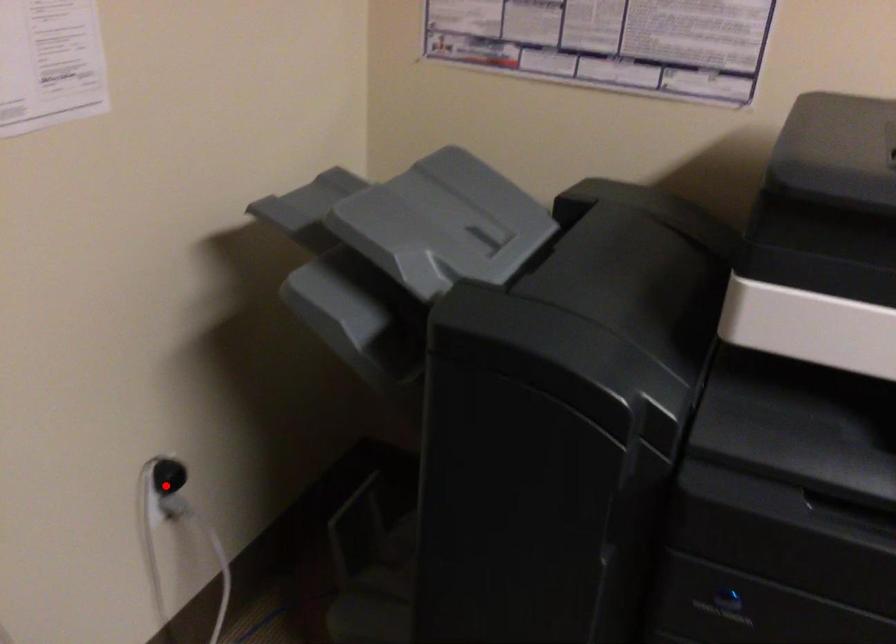
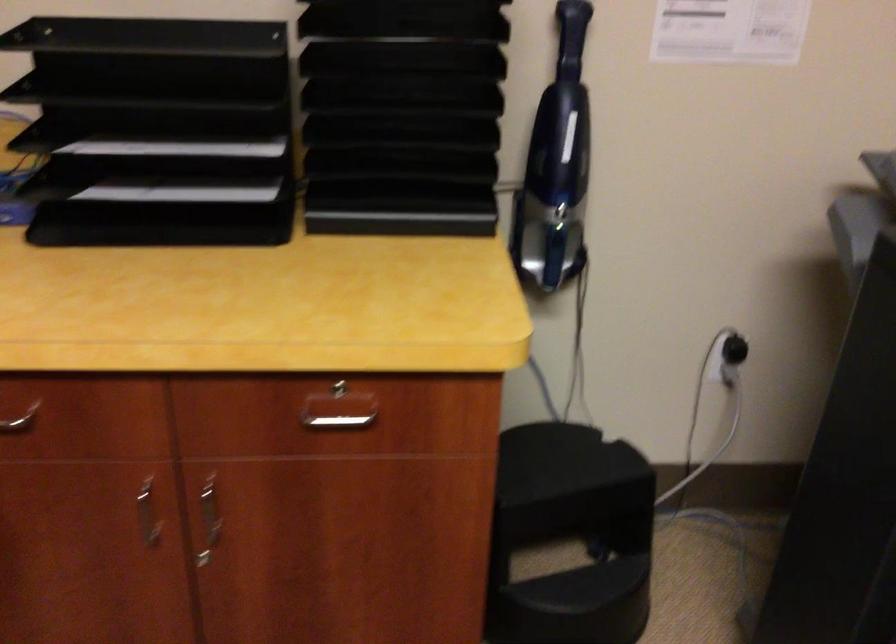
Question: A red point is marked in image1. In image2, is the corresponding 3D point closer to the camera or farther? Reply with the corresponding letter.

Choices:
 (A) The corresponding 3D point is closer.
 (B) The corresponding 3D point is farther.

Answer: (B)